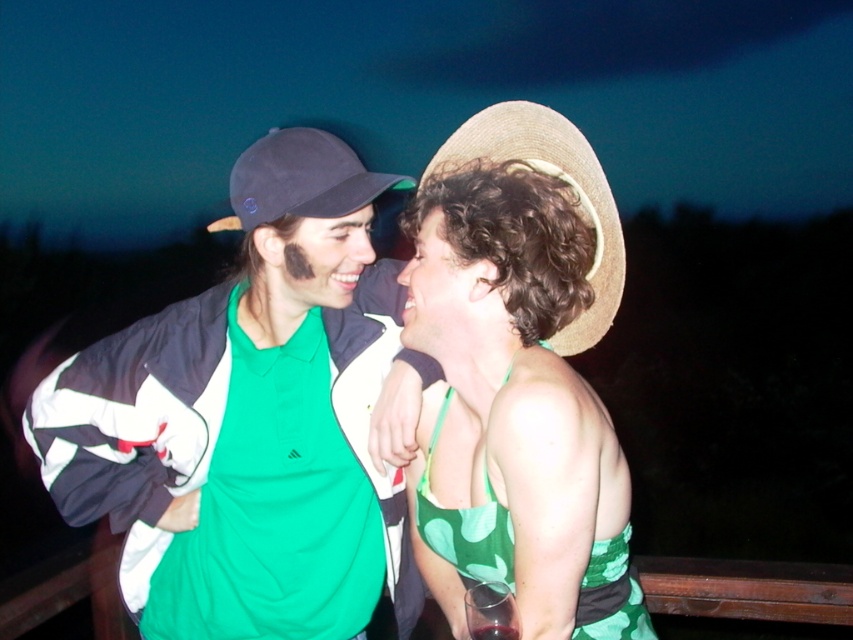
Question: Does green leafy fabric dress at center have a larger size compared to straw hat at right?

Choices:
 (A) yes
 (B) no

Answer: (B)

Question: Does green matte jacket at left lie behind straw hat at right?

Choices:
 (A) yes
 (B) no

Answer: (A)

Question: Can you confirm if green leafy fabric dress at center is positioned above straw hat at right?

Choices:
 (A) yes
 (B) no

Answer: (B)

Question: Among these points, which one is nearest to the camera?

Choices:
 (A) (527, 474)
 (B) (602, 250)
 (C) (248, 173)
 (D) (73, 477)

Answer: (A)

Question: Among these objects, which one is nearest to the camera?

Choices:
 (A) matte black baseball cap at left
 (B) green matte jacket at left
 (C) green leafy fabric dress at center
 (D) straw hat at right

Answer: (C)

Question: Which point is closer to the camera?

Choices:
 (A) green matte jacket at left
 (B) matte black baseball cap at left

Answer: (A)